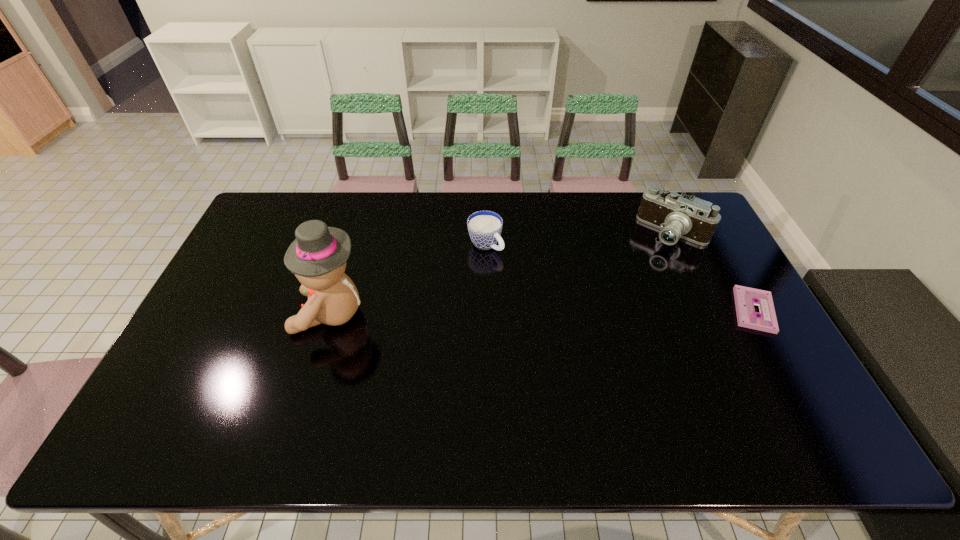
Where is `vacant space located on the side of the cup with the handle`? vacant space located on the side of the cup with the handle is located at coordinates (590, 328).

Identify the location of free space located 0.240m on the side of the cup with the handle. The image size is (960, 540). (551, 297).

The image size is (960, 540). Find the location of `free space located 0.050m on the side of the cup with the handle`. free space located 0.050m on the side of the cup with the handle is located at coordinates 508,263.

Locate an element on the screen. The image size is (960, 540). free location located 0.050m at the lens of the second tallest object is located at coordinates (649, 255).

The height and width of the screenshot is (540, 960). Find the location of `free region located 0.320m at the lens of the second tallest object`. free region located 0.320m at the lens of the second tallest object is located at coordinates (601, 299).

Where is `vacant space located at the lens of the second tallest object`? vacant space located at the lens of the second tallest object is located at coordinates (626, 276).

The width and height of the screenshot is (960, 540). Identify the location of cup present at the far edge. (484, 227).

I want to click on camera positioned at the far edge, so click(677, 216).

The image size is (960, 540). Find the location of `videotape that is at the right edge`. videotape that is at the right edge is located at coordinates click(745, 298).

This screenshot has height=540, width=960. I want to click on camera at the right edge, so click(677, 216).